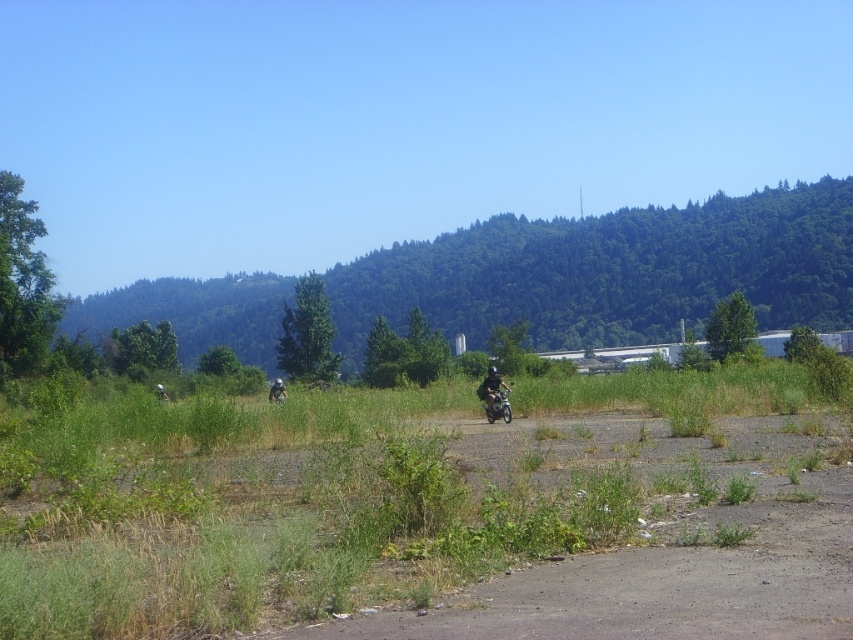
Question: Does metallic silver helmet at center appear on the left side of light gray helmeted person at center?

Choices:
 (A) no
 (B) yes

Answer: (A)

Question: Is gravelly brown dirt field at center below light gray helmeted person at center?

Choices:
 (A) yes
 (B) no

Answer: (B)

Question: Can you confirm if gravelly brown dirt field at center is positioned above metallic silver helmet at center?

Choices:
 (A) yes
 (B) no

Answer: (A)

Question: Which object is farther from the camera taking this photo?

Choices:
 (A) metallic silver helmet at center
 (B) light gray helmeted person at center

Answer: (A)

Question: Among these objects, which one is farthest from the camera?

Choices:
 (A) gravelly brown dirt field at center
 (B) metallic silver helmet at center
 (C) light gray helmeted person at center

Answer: (B)

Question: Which of the following is the farthest from the observer?

Choices:
 (A) gravelly brown dirt field at center
 (B) light gray helmeted person at center
 (C) metallic silver helmet at center

Answer: (C)